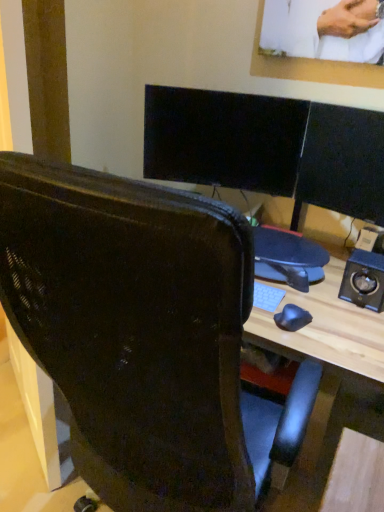
Question: From a real-world perspective, is matte black chair at center positioned over metallic black speaker at right based on gravity?

Choices:
 (A) yes
 (B) no

Answer: (B)

Question: Is there a large distance between matte black chair at center and metallic black speaker at right?

Choices:
 (A) no
 (B) yes

Answer: (A)

Question: Is matte black chair at center positioned beyond the bounds of metallic black speaker at right?

Choices:
 (A) no
 (B) yes

Answer: (B)

Question: Considering the relative positions of matte black chair at center and metallic black speaker at right in the image provided, is matte black chair at center behind metallic black speaker at right?

Choices:
 (A) yes
 (B) no

Answer: (B)

Question: Is matte black chair at center taller than metallic black speaker at right?

Choices:
 (A) no
 (B) yes

Answer: (B)

Question: Can you confirm if matte black chair at center is smaller than metallic black speaker at right?

Choices:
 (A) yes
 (B) no

Answer: (B)

Question: Is there a large distance between metallic black speaker at right and matte black chair at center?

Choices:
 (A) no
 (B) yes

Answer: (A)

Question: Can you confirm if metallic black speaker at right is bigger than matte black chair at center?

Choices:
 (A) yes
 (B) no

Answer: (B)

Question: Does metallic black speaker at right have a greater height compared to matte black chair at center?

Choices:
 (A) yes
 (B) no

Answer: (B)

Question: Can you confirm if metallic black speaker at right is shorter than matte black chair at center?

Choices:
 (A) yes
 (B) no

Answer: (A)

Question: Can you confirm if metallic black speaker at right is smaller than matte black chair at center?

Choices:
 (A) yes
 (B) no

Answer: (A)

Question: Can you confirm if metallic black speaker at right is thinner than matte black chair at center?

Choices:
 (A) no
 (B) yes

Answer: (B)

Question: In the image, is metallic black speaker at right on the left side or the right side of matte black chair at center?

Choices:
 (A) left
 (B) right

Answer: (B)